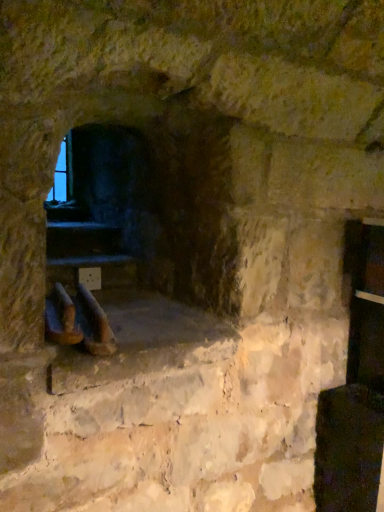
What do you see at coordinates (121, 218) in the screenshot?
I see `dark stone fireplace at center` at bounding box center [121, 218].

This screenshot has height=512, width=384. Find the location of `brown leather boot at lower left, the 1th footwear when ordered from left to right`. brown leather boot at lower left, the 1th footwear when ordered from left to right is located at coordinates (61, 318).

Where is `brown leather boot at center, which is the second footwear from left to right`? brown leather boot at center, which is the second footwear from left to right is located at coordinates (93, 324).

I want to click on footwear above the brown leather boot at center, the 1th footwear in the right-to-left sequence (from the image's perspective), so click(x=61, y=318).

From the image's perspective, between brown leather boot at center, the 1th footwear in the right-to-left sequence, and brown leather boot at lower left, marked as the second footwear in a right-to-left arrangement, which one is located above?

brown leather boot at lower left, marked as the second footwear in a right-to-left arrangement.

Which is closer, (189, 275) or (75, 335)?

Point (75, 335)

From the image's perspective, between dark stone fireplace at center and brown leather boot at lower left, marked as the second footwear in a right-to-left arrangement, which one is located above?

dark stone fireplace at center.

Could you measure the distance between dark stone fireplace at center and brown leather boot at lower left, marked as the second footwear in a right-to-left arrangement?

dark stone fireplace at center is 23.45 inches away from brown leather boot at lower left, marked as the second footwear in a right-to-left arrangement.

Choose the correct answer: Is dark stone fireplace at center inside brown leather boot at lower left, marked as the second footwear in a right-to-left arrangement, or outside it?

dark stone fireplace at center exists outside the volume of brown leather boot at lower left, marked as the second footwear in a right-to-left arrangement.

Considering the positions of point (112, 161) and point (77, 308), is point (112, 161) closer or farther from the camera than point (77, 308)?

Point (112, 161) is positioned farther from the camera compared to point (77, 308).

Is dark stone fireplace at center next to brown leather boot at center, which is the second footwear from left to right, and touching it?

dark stone fireplace at center is not next to brown leather boot at center, which is the second footwear from left to right, and they're not touching.

Based on the photo, considering the positions of objects dark stone fireplace at center and brown leather boot at center, which is the second footwear from left to right, in the image provided, who is more to the left, dark stone fireplace at center or brown leather boot at center, which is the second footwear from left to right,?

Positioned to the left is brown leather boot at center, which is the second footwear from left to right.

From the picture: From the image's perspective, is dark stone fireplace at center beneath brown leather boot at center, the 1th footwear in the right-to-left sequence?

No, from the image's perspective, dark stone fireplace at center is not beneath brown leather boot at center, the 1th footwear in the right-to-left sequence.

Can you see brown leather boot at center, which is the second footwear from left to right, touching dark stone fireplace at center?

There is a gap between brown leather boot at center, which is the second footwear from left to right, and dark stone fireplace at center.

Between point (85, 310) and point (81, 223), which one is positioned behind?

The point (81, 223) is more distant.

From a real-world perspective, which object stands above the other?

From a 3D spatial view, dark stone fireplace at center is above.

Which object is positioned more to the right, brown leather boot at center, the 1th footwear in the right-to-left sequence, or dark stone fireplace at center?

dark stone fireplace at center.

From their relative heights in the image, would you say brown leather boot at lower left, the 1th footwear when ordered from left to right, is taller or shorter than dark stone fireplace at center?

Clearly, brown leather boot at lower left, the 1th footwear when ordered from left to right, is shorter compared to dark stone fireplace at center.

The width and height of the screenshot is (384, 512). I want to click on the 1st footwear positioned below the dark stone fireplace at center (from the image's perspective), so click(x=61, y=318).

Considering the sizes of objects brown leather boot at lower left, marked as the second footwear in a right-to-left arrangement, and dark stone fireplace at center in the image provided, who is thinner, brown leather boot at lower left, marked as the second footwear in a right-to-left arrangement, or dark stone fireplace at center?

dark stone fireplace at center is thinner.

Which is more to the right, brown leather boot at lower left, marked as the second footwear in a right-to-left arrangement, or dark stone fireplace at center?

From the viewer's perspective, dark stone fireplace at center appears more on the right side.

Is brown leather boot at lower left, the 1th footwear when ordered from left to right, at the right side of brown leather boot at center, which is the second footwear from left to right?

Incorrect, brown leather boot at lower left, the 1th footwear when ordered from left to right, is not on the right side of brown leather boot at center, which is the second footwear from left to right.

In terms of width, does brown leather boot at lower left, marked as the second footwear in a right-to-left arrangement, look wider or thinner when compared to brown leather boot at center, the 1th footwear in the right-to-left sequence?

In the image, brown leather boot at lower left, marked as the second footwear in a right-to-left arrangement, appears to be more narrow than brown leather boot at center, the 1th footwear in the right-to-left sequence.

Based on the photo, from the image's perspective, is brown leather boot at lower left, the 1th footwear when ordered from left to right, positioned above or below brown leather boot at center, which is the second footwear from left to right?

Clearly, from the image's perspective, brown leather boot at lower left, the 1th footwear when ordered from left to right, is above brown leather boot at center, which is the second footwear from left to right.

Does point (59, 286) lie behind point (82, 325)?

Yes, it is behind point (82, 325).

Locate an element on the screen. This screenshot has width=384, height=512. footwear in front of the brown leather boot at center, which is the second footwear from left to right is located at coordinates (61, 318).

At what (x,y) coordinates should I click in order to perform the action: click on fireplace located above the brown leather boot at lower left, the 1th footwear when ordered from left to right (from a real-world perspective). Please return your answer as a coordinate pair (x, y). Looking at the image, I should click on (121, 218).

When comparing their distances from brown leather boot at lower left, the 1th footwear when ordered from left to right, does brown leather boot at center, which is the second footwear from left to right, or dark stone fireplace at center seem closer?

brown leather boot at center, which is the second footwear from left to right, lies closer to brown leather boot at lower left, the 1th footwear when ordered from left to right, than the other object.

Based on their spatial positions, is brown leather boot at lower left, the 1th footwear when ordered from left to right, or brown leather boot at center, which is the second footwear from left to right, closer to dark stone fireplace at center?

Among the two, brown leather boot at center, which is the second footwear from left to right, is located nearer to dark stone fireplace at center.

Estimate the real-world distances between objects in this image. Which object is further from brown leather boot at center, the 1th footwear in the right-to-left sequence, dark stone fireplace at center or brown leather boot at lower left, the 1th footwear when ordered from left to right?

dark stone fireplace at center.

Considering their positions, is dark stone fireplace at center positioned closer to brown leather boot at lower left, marked as the second footwear in a right-to-left arrangement, than brown leather boot at center, which is the second footwear from left to right?

brown leather boot at center, which is the second footwear from left to right.

From the picture: Which object lies further to the anchor point dark stone fireplace at center, brown leather boot at center, the 1th footwear in the right-to-left sequence, or brown leather boot at lower left, marked as the second footwear in a right-to-left arrangement?

Based on the image, brown leather boot at lower left, marked as the second footwear in a right-to-left arrangement, appears to be further to dark stone fireplace at center.

When comparing their distances from brown leather boot at center, the 1th footwear in the right-to-left sequence, does brown leather boot at lower left, marked as the second footwear in a right-to-left arrangement, or dark stone fireplace at center seem closer?

brown leather boot at lower left, marked as the second footwear in a right-to-left arrangement, is closer to brown leather boot at center, the 1th footwear in the right-to-left sequence.

You are a GUI agent. You are given a task and a screenshot of the screen. Output one action in this format:
    pyautogui.click(x=<x>, y=<y>)
    Task: Click on the footwear between dark stone fireplace at center and brown leather boot at center, which is the second footwear from left to right, from top to bottom
    The image size is (384, 512).
    Given the screenshot: What is the action you would take?
    pyautogui.click(x=61, y=318)